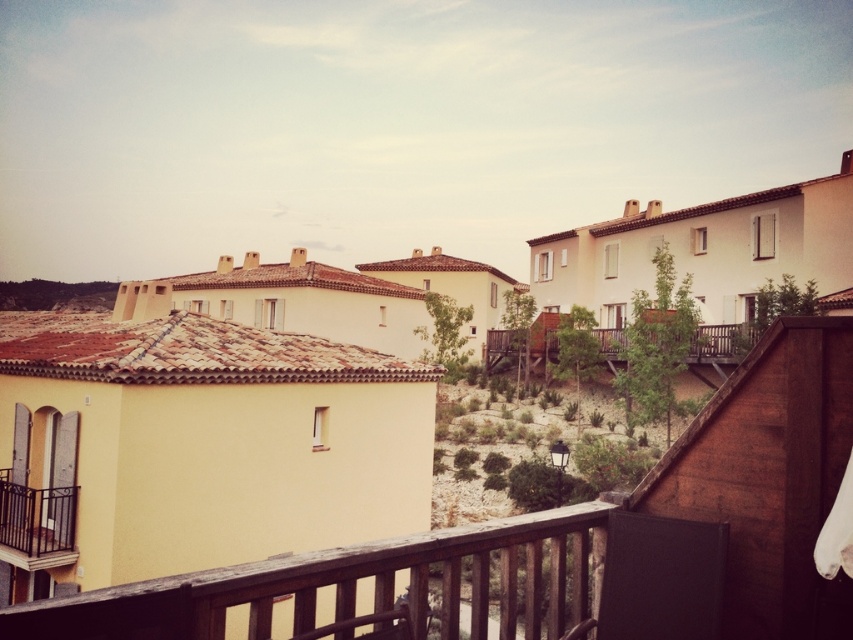
You are standing on the balcony and want to step onto the wooden at lower center. Given that an average person is about 5.5 feet tall, can you safely step down without overreaching?

The wooden at lower center and viewer are 8.65 feet apart. Since an average person is only 5.5 feet tall, this distance is too far to safely step down without overreaching.

You are standing on a balcony in this residential area and notice two points marked in the image. The first point is at coordinates point [532,612] and the second is at point [18,499]. Which of these points is closer to you as you stand on the balcony?

Point [532,612] is in front of point [18,499], so it is closer to you as you stand on the balcony.